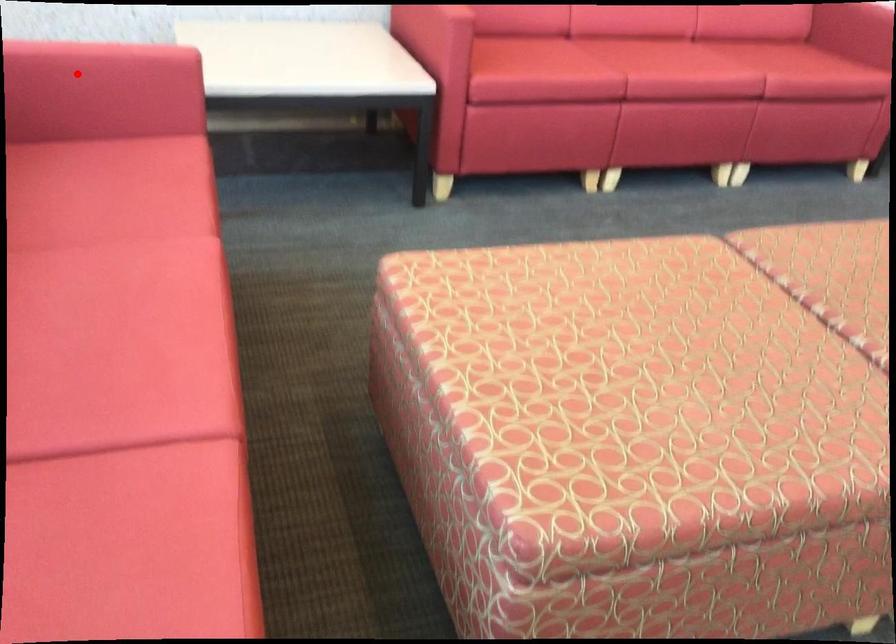
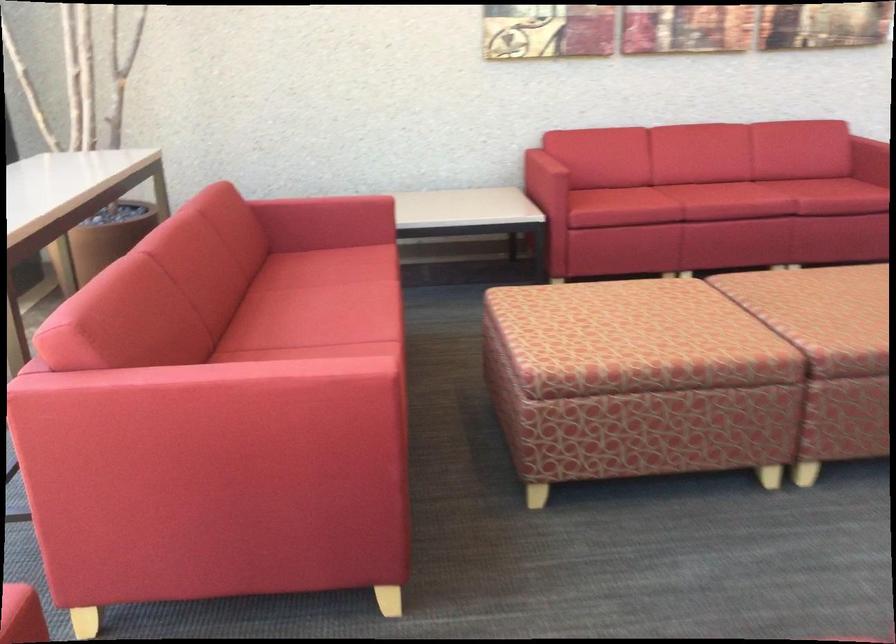
Question: A red point is marked in image1. In image2, is the corresponding 3D point closer to the camera or farther? Reply with the corresponding letter.

Choices:
 (A) The corresponding 3D point is closer.
 (B) The corresponding 3D point is farther.

Answer: (B)